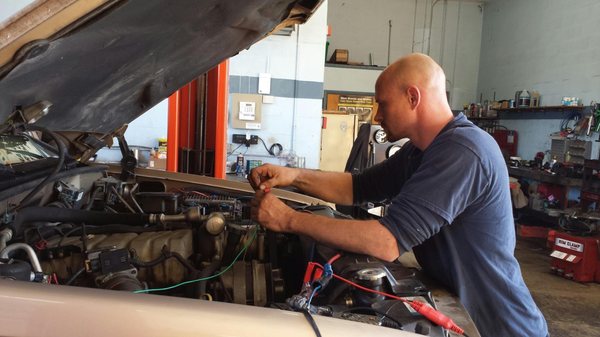
At what (x,y) coordinates should I click in order to perform the action: click on floor. Please return your answer as a coordinate pair (x, y). The image size is (600, 337). Looking at the image, I should click on (570, 312).